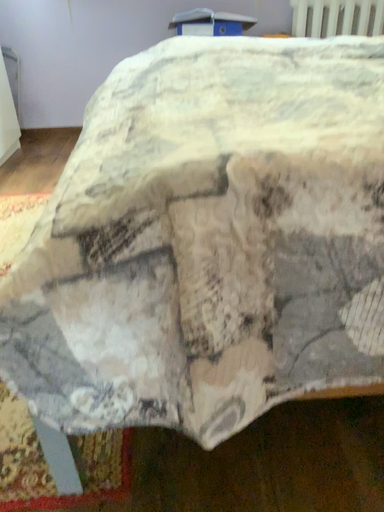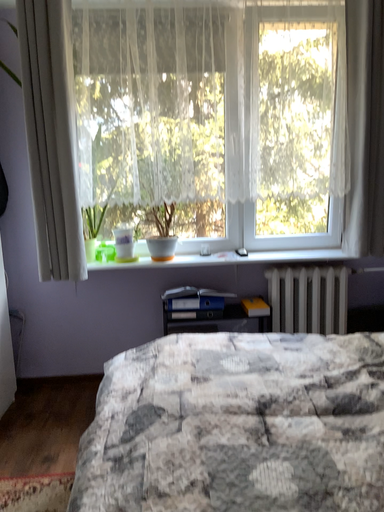
Question: Which way did the camera rotate in the video?

Choices:
 (A) rotated downward
 (B) rotated upward

Answer: (B)